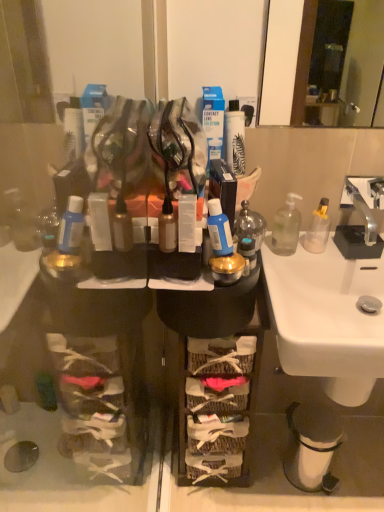
Question: Is woven baskets at center touching translucent glass bottle at center, the 1th bottle viewed from the left?

Choices:
 (A) no
 (B) yes

Answer: (A)

Question: Would you say woven baskets at center is a long distance from translucent glass bottle at center, acting as the third bottle starting from the right?

Choices:
 (A) no
 (B) yes

Answer: (A)

Question: From the image's perspective, is woven baskets at center located above translucent glass bottle at center, acting as the third bottle starting from the right?

Choices:
 (A) yes
 (B) no

Answer: (B)

Question: Is woven baskets at center located outside translucent glass bottle at center, the 1th bottle viewed from the left?

Choices:
 (A) yes
 (B) no

Answer: (A)

Question: Can you confirm if woven baskets at center is wider than translucent glass bottle at center, the 1th bottle viewed from the left?

Choices:
 (A) yes
 (B) no

Answer: (A)

Question: From a real-world perspective, is woven baskets at center located beneath translucent glass bottle at center, acting as the third bottle starting from the right?

Choices:
 (A) yes
 (B) no

Answer: (A)

Question: Is transparent glass soap dispenser at right, acting as the 2th bottle starting from the right, shorter than clear plastic bottle at right, the 1th bottle from the right?

Choices:
 (A) no
 (B) yes

Answer: (A)

Question: Can you confirm if transparent glass soap dispenser at right, the 2th bottle in the left-to-right sequence, is taller than clear plastic bottle at right, the third bottle positioned from the left?

Choices:
 (A) no
 (B) yes

Answer: (B)

Question: Considering the relative sizes of transparent glass soap dispenser at right, acting as the 2th bottle starting from the right, and clear plastic bottle at right, the third bottle positioned from the left, in the image provided, is transparent glass soap dispenser at right, acting as the 2th bottle starting from the right, wider than clear plastic bottle at right, the third bottle positioned from the left,?

Choices:
 (A) yes
 (B) no

Answer: (A)

Question: From a real-world perspective, is transparent glass soap dispenser at right, the 2th bottle in the left-to-right sequence, over clear plastic bottle at right, the third bottle positioned from the left?

Choices:
 (A) no
 (B) yes

Answer: (B)

Question: Considering the relative positions of transparent glass soap dispenser at right, the 2th bottle in the left-to-right sequence, and clear plastic bottle at right, the 1th bottle from the right, in the image provided, is transparent glass soap dispenser at right, the 2th bottle in the left-to-right sequence, in front of clear plastic bottle at right, the 1th bottle from the right,?

Choices:
 (A) yes
 (B) no

Answer: (A)

Question: Would you say transparent glass soap dispenser at right, acting as the 2th bottle starting from the right, is outside clear plastic bottle at right, the 1th bottle from the right?

Choices:
 (A) no
 (B) yes

Answer: (B)

Question: Is translucent glass bottle at center, acting as the third bottle starting from the right, positioned beyond the bounds of blue matte bottle at center, which ranks as the second toiletry in left-to-right order?

Choices:
 (A) no
 (B) yes

Answer: (B)